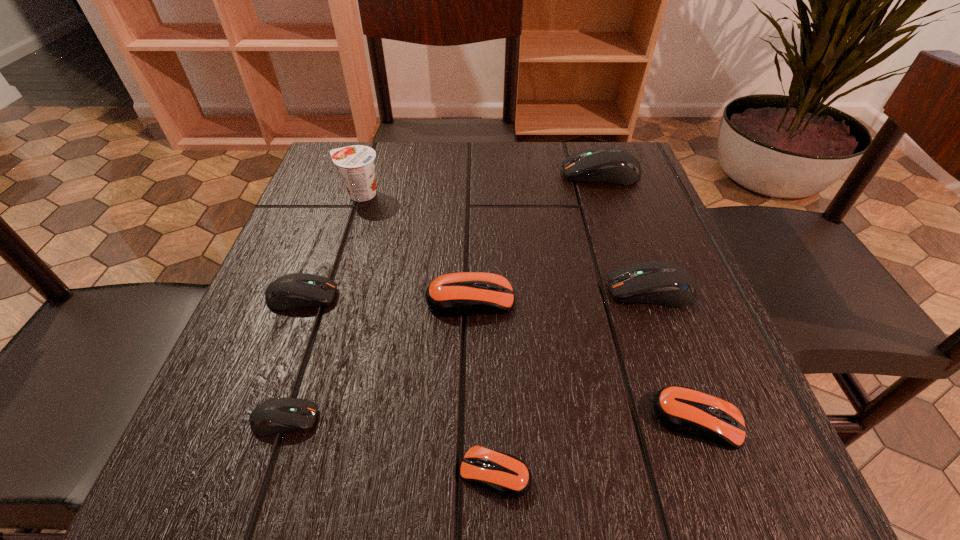
You are a GUI agent. You are given a task and a screenshot of the screen. Output one action in this format:
    pyautogui.click(x=<x>, y=<y>)
    Task: Click on the dark computer equipment identified as the fourth closest to the biggest orange computer mouse
    
    Given the screenshot: What is the action you would take?
    pyautogui.click(x=611, y=165)

What are the coordinates of `the third closest dark computer equipment to the third biggest dark computer equipment` in the screenshot? It's located at [611, 165].

Locate an element on the screen. The image size is (960, 540). orange computer mouse that is the closest to the biggest orange computer mouse is located at coordinates pos(506,475).

Identify which orange computer mouse is the second closest to the smallest orange computer mouse. Please provide its 2D coordinates. Your answer should be formatted as a tuple, i.e. [(x, y)], where the tuple contains the x and y coordinates of a point satisfying the conditions above.

[(457, 294)]

Where is `free space that satisfies the following two spatial constraints: 1. on the back side of the shortest object; 2. on the button of the smallest dark computer equipment`? Image resolution: width=960 pixels, height=540 pixels. free space that satisfies the following two spatial constraints: 1. on the back side of the shortest object; 2. on the button of the smallest dark computer equipment is located at coordinates (493, 419).

At what (x,y) coordinates should I click in order to perform the action: click on free location that satisfies the following two spatial constraints: 1. on the button of the farthest computer mouse; 2. on the front side of the farthest orange computer mouse. Please return your answer as a coordinate pair (x, y). This screenshot has height=540, width=960. Looking at the image, I should click on (644, 299).

This screenshot has height=540, width=960. Find the location of `vacant area in the image that satisfies the following two spatial constraints: 1. on the button of the second tallest computer mouse; 2. on the front side of the shortest object`. vacant area in the image that satisfies the following two spatial constraints: 1. on the button of the second tallest computer mouse; 2. on the front side of the shortest object is located at coordinates (717, 473).

Locate an element on the screen. The width and height of the screenshot is (960, 540). free space that satisfies the following two spatial constraints: 1. on the front side of the yogurt; 2. on the button of the third biggest dark computer equipment is located at coordinates (327, 296).

The image size is (960, 540). Find the location of `free spot that satisfies the following two spatial constraints: 1. on the button of the rightmost orange computer mouse; 2. on the right side of the farthest dark computer equipment`. free spot that satisfies the following two spatial constraints: 1. on the button of the rightmost orange computer mouse; 2. on the right side of the farthest dark computer equipment is located at coordinates [685, 420].

The image size is (960, 540). What are the coordinates of `free spot that satisfies the following two spatial constraints: 1. on the front side of the farthest orange computer mouse; 2. on the button of the nearest dark computer equipment` in the screenshot? It's located at (468, 419).